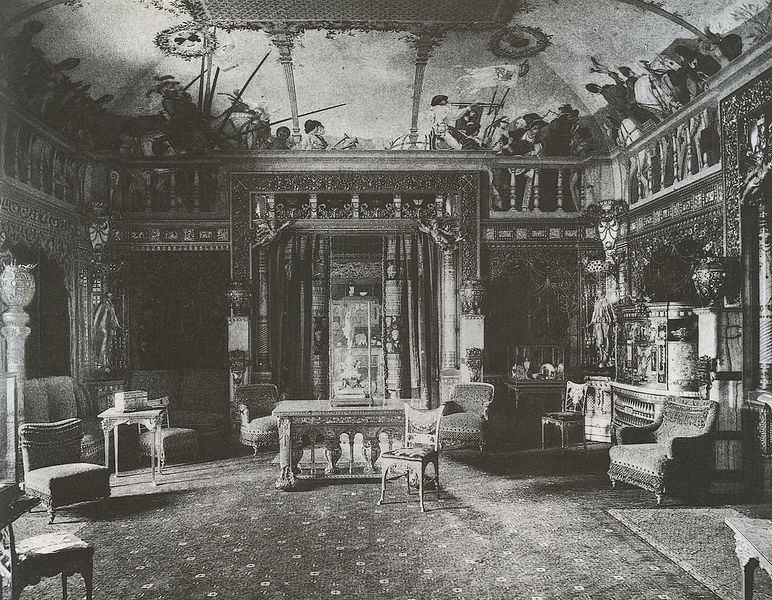
The width and height of the screenshot is (772, 600). Identify the location of mirror. (666, 277).